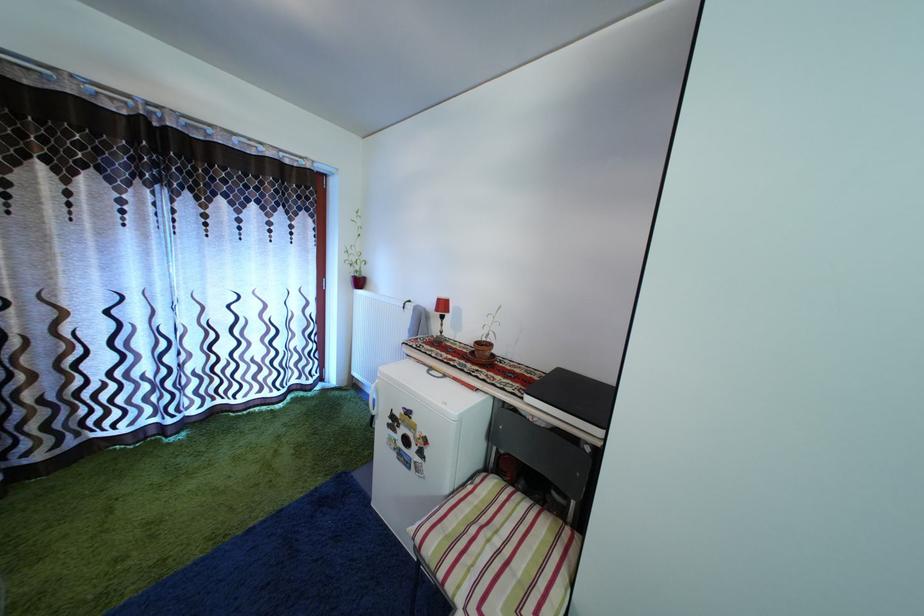
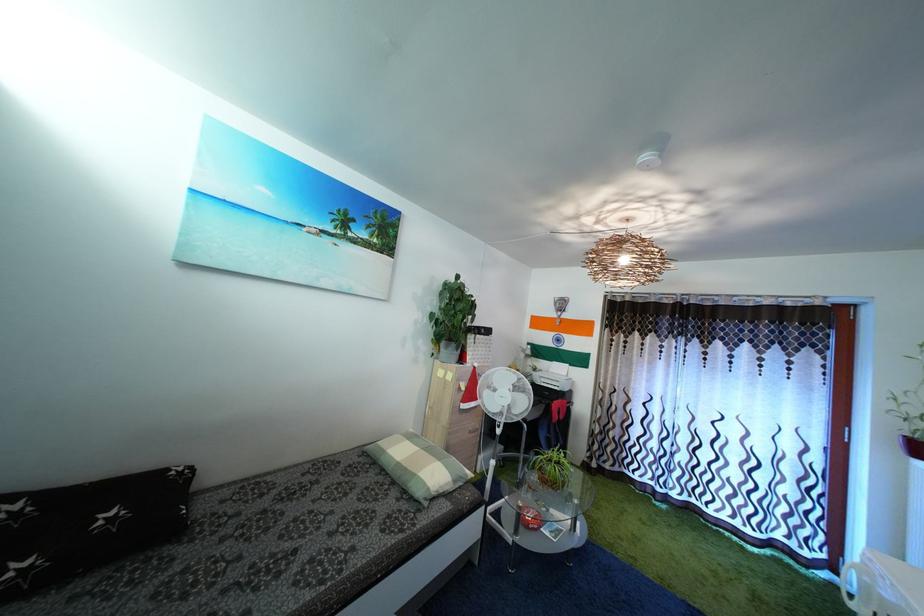
Question: The first image is from the beginning of the video and the second image is from the end. How did the camera likely rotate when shooting the video?

Choices:
 (A) Left
 (B) Right
 (C) Up
 (D) Down

Answer: (A)